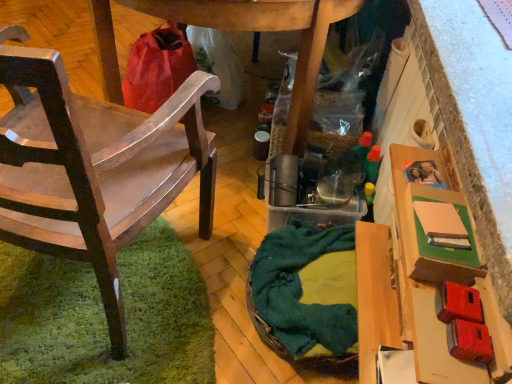
Question: Should I look upward or downward to see wooden chair at left?

Choices:
 (A) down
 (B) up

Answer: (B)

Question: Considering the relative sizes of wooden chair at left and green woven basket at center in the image provided, is wooden chair at left taller than green woven basket at center?

Choices:
 (A) yes
 (B) no

Answer: (A)

Question: Could you tell me if wooden chair at left is turned towards green woven basket at center?

Choices:
 (A) yes
 (B) no

Answer: (B)

Question: Can you confirm if wooden chair at left is positioned to the right of green woven basket at center?

Choices:
 (A) yes
 (B) no

Answer: (B)

Question: Is wooden chair at left thinner than green woven basket at center?

Choices:
 (A) yes
 (B) no

Answer: (B)

Question: Is the position of wooden chair at left less distant than that of green woven basket at center?

Choices:
 (A) no
 (B) yes

Answer: (B)

Question: Does wooden chair at left lie behind green woven basket at center?

Choices:
 (A) yes
 (B) no

Answer: (B)

Question: From a real-world perspective, is green woven basket at center positioned over wooden chair at left based on gravity?

Choices:
 (A) no
 (B) yes

Answer: (A)

Question: Is green woven basket at center placed right next to wooden chair at left?

Choices:
 (A) no
 (B) yes

Answer: (A)

Question: Is wooden chair at left surrounded by green woven basket at center?

Choices:
 (A) yes
 (B) no

Answer: (B)

Question: From the image's perspective, is green woven basket at center on top of wooden chair at left?

Choices:
 (A) no
 (B) yes

Answer: (A)

Question: Would you say green woven basket at center is a long distance from wooden chair at left?

Choices:
 (A) no
 (B) yes

Answer: (A)

Question: Is green woven basket at center shorter than wooden chair at left?

Choices:
 (A) no
 (B) yes

Answer: (B)

Question: Can you confirm if matte brown cardboard box at right is wider than wooden chair at left?

Choices:
 (A) no
 (B) yes

Answer: (A)